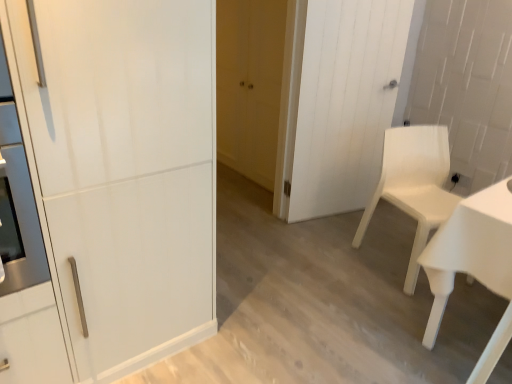
Question: Does white wood door at center, the 3th door positioned from the left, have a lesser height compared to matte yellow door at center, arranged as the 3th door when viewed from the front?

Choices:
 (A) no
 (B) yes

Answer: (A)

Question: Is white wood door at center, the 1th door when ordered from right to left, far from matte yellow door at center, which appears as the 1th door when viewed from the back?

Choices:
 (A) no
 (B) yes

Answer: (A)

Question: Considering the relative positions of white wood door at center, the second door when ordered from back to front, and matte yellow door at center, which is the 2th door from right to left, in the image provided, is white wood door at center, the second door when ordered from back to front, to the left of matte yellow door at center, which is the 2th door from right to left, from the viewer's perspective?

Choices:
 (A) yes
 (B) no

Answer: (B)

Question: From the image's perspective, is white wood door at center, the 3th door positioned from the left, located beneath matte yellow door at center, arranged as the 3th door when viewed from the front?

Choices:
 (A) no
 (B) yes

Answer: (B)

Question: Is white wood door at center, the 1th door when ordered from right to left, located outside matte yellow door at center, arranged as the 3th door when viewed from the front?

Choices:
 (A) no
 (B) yes

Answer: (B)

Question: Looking at their shapes, would you say white plastic chair at right is wider or thinner than white wood door at center, the 1th door when ordered from right to left?

Choices:
 (A) thin
 (B) wide

Answer: (B)

Question: From a real-world perspective, relative to white wood door at center, the second door when ordered from back to front, is white plastic chair at right vertically above or below?

Choices:
 (A) below
 (B) above

Answer: (A)

Question: From the image's perspective, is white plastic chair at right located above or below white wood door at center, the 3th door positioned from the left?

Choices:
 (A) below
 (B) above

Answer: (A)

Question: Is white plastic chair at right taller or shorter than white wood door at center, arranged as the second door when viewed from the front?

Choices:
 (A) tall
 (B) short

Answer: (B)

Question: Is white plastic chair at right taller or shorter than matte yellow door at center, arranged as the 3th door when viewed from the front?

Choices:
 (A) tall
 (B) short

Answer: (B)

Question: Considering the positions of white plastic chair at right and matte yellow door at center, arranged as the 3th door when viewed from the front, in the image, is white plastic chair at right wider or thinner than matte yellow door at center, arranged as the 3th door when viewed from the front,?

Choices:
 (A) wide
 (B) thin

Answer: (A)

Question: Visually, is white plastic chair at right positioned to the left or to the right of matte yellow door at center, which appears as the 1th door when viewed from the back?

Choices:
 (A) right
 (B) left

Answer: (A)

Question: From the image's perspective, is white plastic chair at right located above or below matte yellow door at center, which appears as the 1th door when viewed from the back?

Choices:
 (A) above
 (B) below

Answer: (B)

Question: From a real-world perspective, is white wood door at center, the 1th door when ordered from right to left, above or below white plastic chair at right?

Choices:
 (A) above
 (B) below

Answer: (A)

Question: Considering the positions of white wood door at center, the 3th door positioned from the left, and white plastic chair at right in the image, is white wood door at center, the 3th door positioned from the left, wider or thinner than white plastic chair at right?

Choices:
 (A) wide
 (B) thin

Answer: (B)